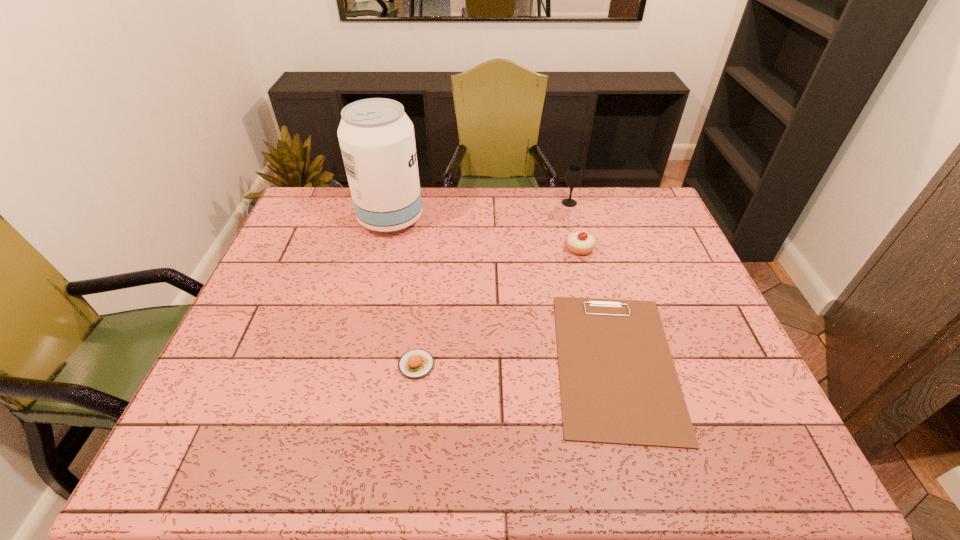
In order to click on alcohol positioned at the far edge in this screenshot , I will do `click(376, 137)`.

Locate an element on the screen. This screenshot has width=960, height=540. wineglass that is at the far edge is located at coordinates (573, 176).

Locate an element on the screen. object present at the near edge is located at coordinates (618, 382).

The image size is (960, 540). In order to click on object situated at the right edge in this screenshot , I will do `click(618, 382)`.

The width and height of the screenshot is (960, 540). Find the location of `object positioned at the near right corner`. object positioned at the near right corner is located at coordinates (618, 382).

You are a GUI agent. You are given a task and a screenshot of the screen. Output one action in this format:
    pyautogui.click(x=<x>, y=<y>)
    Task: Click on the free spot at the far edge of the desktop
    This screenshot has width=960, height=540.
    Given the screenshot: What is the action you would take?
    pyautogui.click(x=456, y=207)

At what (x,y) coordinates should I click in order to perform the action: click on vacant area at the near edge. Please return your answer as a coordinate pair (x, y). Looking at the image, I should click on (493, 474).

In the image, there is a desktop. At what (x,y) coordinates should I click in order to perform the action: click on vacant space at the left edge. Please return your answer as a coordinate pair (x, y). Image resolution: width=960 pixels, height=540 pixels. Looking at the image, I should click on (257, 382).

Identify the location of vacant region at the right edge. This screenshot has height=540, width=960. (709, 315).

The width and height of the screenshot is (960, 540). Find the location of `free space at the far right corner of the desktop`. free space at the far right corner of the desktop is located at coordinates (643, 211).